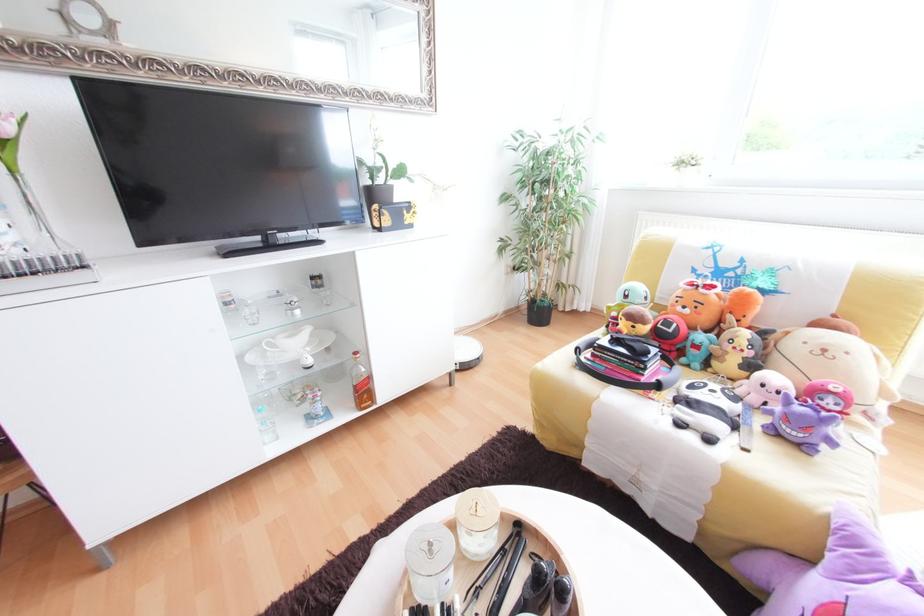
Find where to lift the clear glass bottle. Please return your answer as a coordinate pair (x, y).

(265, 424)